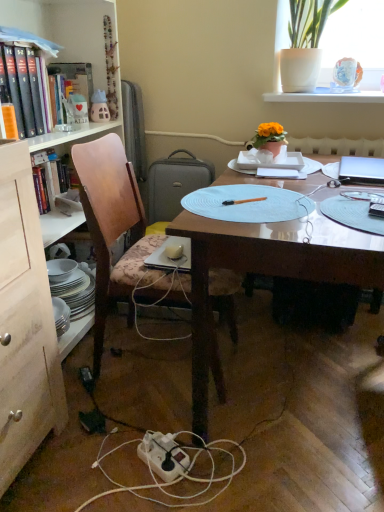
Locate an element on the screen. The height and width of the screenshot is (512, 384). vacant area situated below wooden desk at center (from a real-world perspective) is located at coordinates (297, 384).